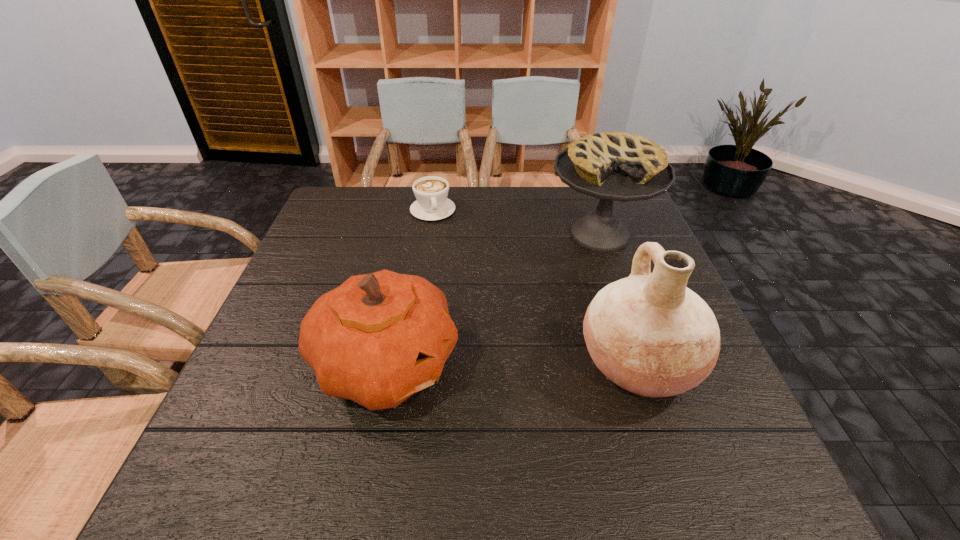
Where is `vacant spot on the desktop that is between the pumpkin and the pottery and is positioned on the cut side of the pie`? vacant spot on the desktop that is between the pumpkin and the pottery and is positioned on the cut side of the pie is located at coordinates (542, 364).

The image size is (960, 540). In order to click on vacant spot on the desktop that is between the pumpkin and the pottery and is positioned to the right of the shortest object's handle in this screenshot , I will do `click(485, 364)`.